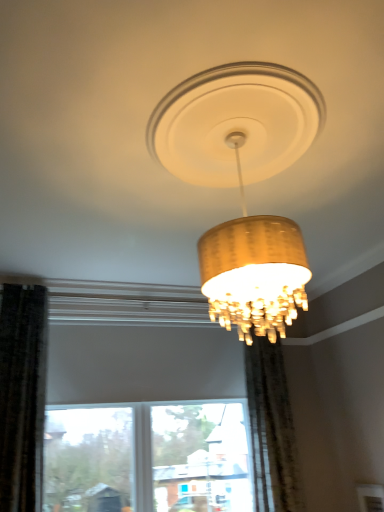
Question: Considering the relative sizes of matte gold chandelier at center and sheer beige curtain at center in the image provided, is matte gold chandelier at center smaller than sheer beige curtain at center?

Choices:
 (A) no
 (B) yes

Answer: (A)

Question: From a real-world perspective, is matte gold chandelier at center located higher than sheer beige curtain at center?

Choices:
 (A) no
 (B) yes

Answer: (B)

Question: Does matte gold chandelier at center have a larger size compared to sheer beige curtain at center?

Choices:
 (A) no
 (B) yes

Answer: (B)

Question: Is the depth of matte gold chandelier at center less than that of sheer beige curtain at center?

Choices:
 (A) no
 (B) yes

Answer: (B)

Question: Considering the relative positions of matte gold chandelier at center and sheer beige curtain at center in the image provided, is matte gold chandelier at center to the right of sheer beige curtain at center from the viewer's perspective?

Choices:
 (A) no
 (B) yes

Answer: (A)

Question: Is matte gold chandelier at center facing away from sheer beige curtain at center?

Choices:
 (A) no
 (B) yes

Answer: (A)

Question: Considering the relative positions of sheer beige curtain at center and matte gold chandelier at center in the image provided, is sheer beige curtain at center to the left of matte gold chandelier at center from the viewer's perspective?

Choices:
 (A) yes
 (B) no

Answer: (B)

Question: From a real-world perspective, is sheer beige curtain at center located higher than matte gold chandelier at center?

Choices:
 (A) yes
 (B) no

Answer: (B)

Question: Considering the relative sizes of sheer beige curtain at center and matte gold chandelier at center in the image provided, is sheer beige curtain at center thinner than matte gold chandelier at center?

Choices:
 (A) no
 (B) yes

Answer: (B)

Question: Is sheer beige curtain at center turned away from matte gold chandelier at center?

Choices:
 (A) no
 (B) yes

Answer: (A)

Question: Does sheer beige curtain at center have a greater width compared to matte gold chandelier at center?

Choices:
 (A) no
 (B) yes

Answer: (A)

Question: From a real-world perspective, does sheer beige curtain at center sit lower than matte gold chandelier at center?

Choices:
 (A) yes
 (B) no

Answer: (A)

Question: In terms of width, does sheer beige curtain at center look wider or thinner when compared to matte gold chandelier at center?

Choices:
 (A) wide
 (B) thin

Answer: (B)